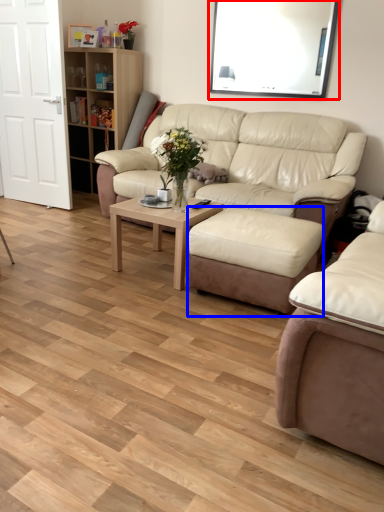
Question: Which of the following is the closest to the observer, window screen (highlighted by a red box) or stool (highlighted by a blue box)?

Choices:
 (A) window screen
 (B) stool

Answer: (B)